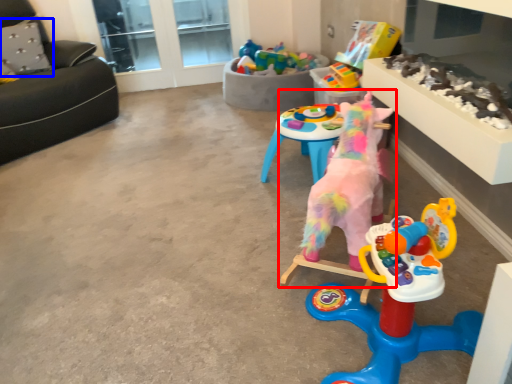
Question: Which object appears farthest to the camera in this image, toy (highlighted by a red box) or pillow (highlighted by a blue box)?

Choices:
 (A) toy
 (B) pillow

Answer: (B)